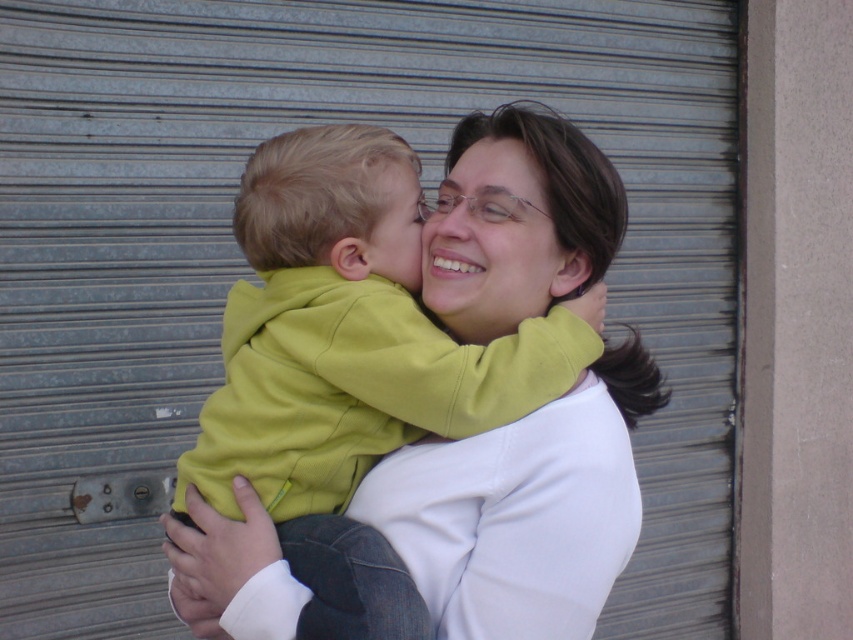
You are a photographer trying to capture a closeup of the matte yellow face at center without the green fleece jacket at center blocking it. What should you do?

The green fleece jacket at center is in front of the matte yellow face at center, so you should move the camera angle to position the matte yellow face at center in front of the green fleece jacket at center or adjust their positions to ensure the matte yellow face at center is visible without obstruction.

You are standing in front of a metallic rollup door. You see a point at coordinate (486, 266). What color is the object at that point?

The object at point (486, 266) is matte yellow face at center.